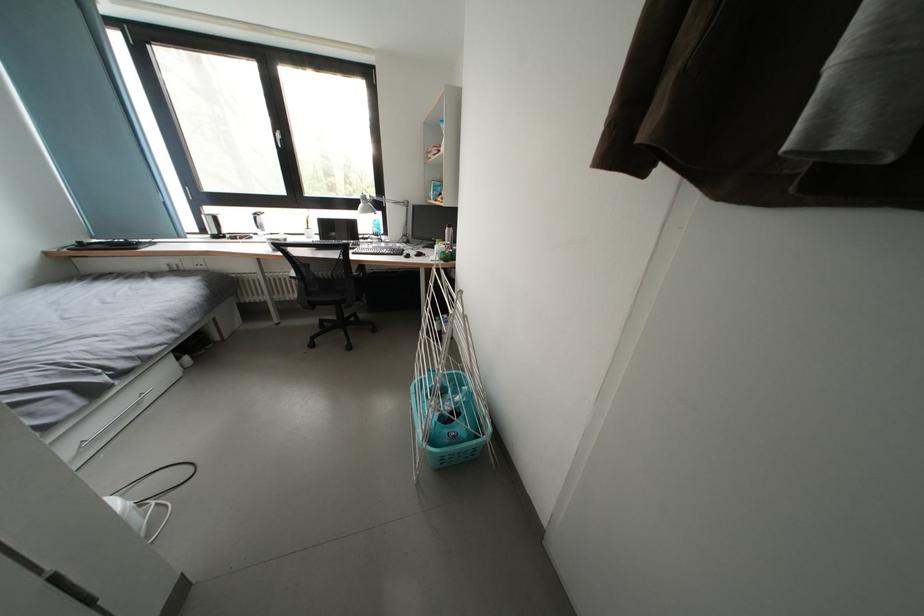
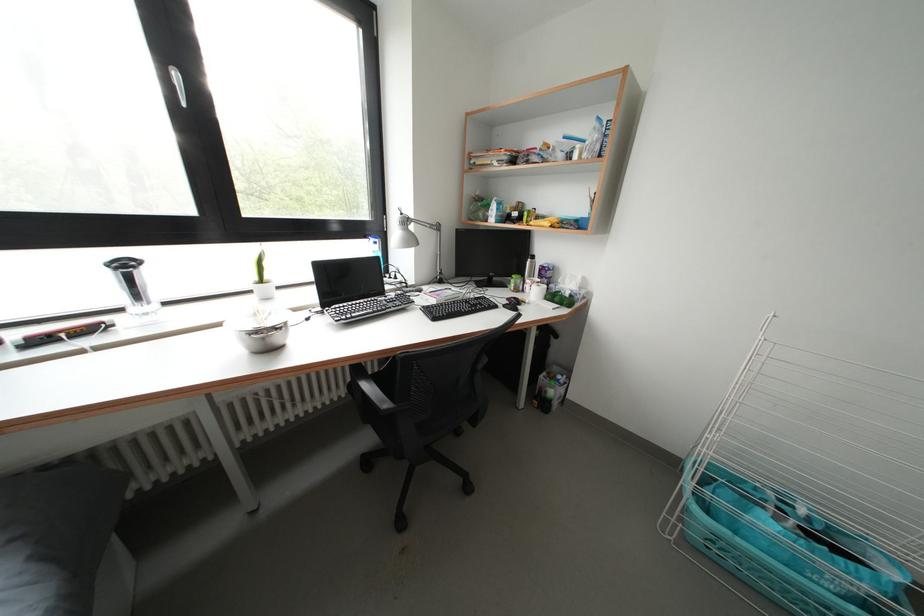
Question: I am providing you with two images of the same scene from different viewpoints. Which of the following objects are not visible in image2?

Choices:
 (A) silver metal bowl
 (B) white lamp head
 (C) silver water bottle
 (D) none of these

Answer: (D)